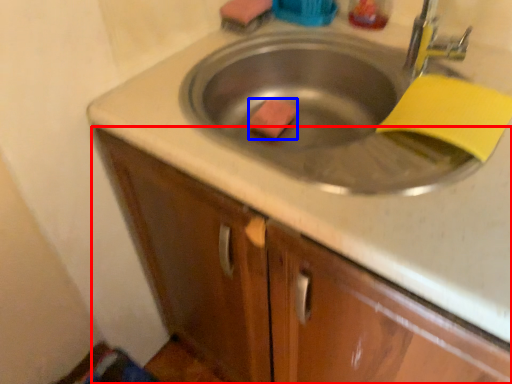
Question: Among these objects, which one is nearest to the camera, cabinetry (highlighted by a red box) or soap (highlighted by a blue box)?

Choices:
 (A) cabinetry
 (B) soap

Answer: (A)